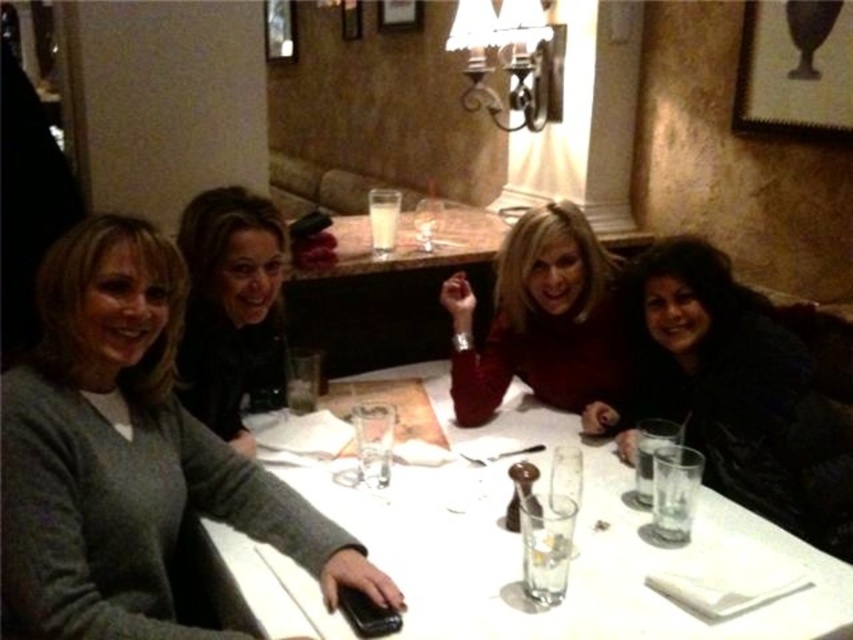
Between gray sweater at left and matte red sweater at center, which one appears on the right side from the viewer's perspective?

Positioned to the right is matte red sweater at center.

Does gray sweater at left have a lesser width compared to matte red sweater at center?

No.

Image resolution: width=853 pixels, height=640 pixels. I want to click on gray sweater at left, so click(x=129, y=456).

Is black fuzzy coat at lower right closer to the viewer compared to clear glass wine glass at center?

Yes.

Which of these two, black fuzzy coat at lower right or clear glass wine glass at center, stands taller?

Standing taller between the two is black fuzzy coat at lower right.

Is point (726, 460) less distant than point (415, 216)?

Yes, point (726, 460) is closer to viewer.

The width and height of the screenshot is (853, 640). In order to click on black fuzzy coat at lower right in this screenshot , I will do `click(735, 392)`.

Where is `white glossy table at center`? This screenshot has width=853, height=640. white glossy table at center is located at coordinates [570, 564].

Does white glossy table at center have a greater width compared to dark brown hair at upper left?

Indeed, white glossy table at center has a greater width compared to dark brown hair at upper left.

Is point (706, 516) positioned before point (222, 336)?

Yes, point (706, 516) is closer to viewer.

The height and width of the screenshot is (640, 853). I want to click on white glossy table at center, so click(x=570, y=564).